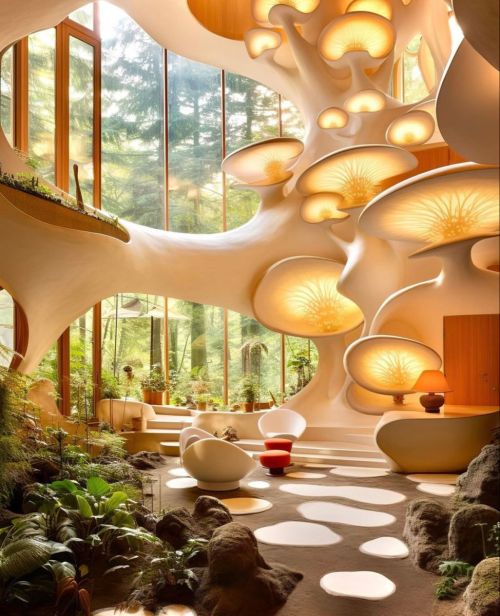
Where is `floor`? Image resolution: width=500 pixels, height=616 pixels. floor is located at coordinates (337, 505).